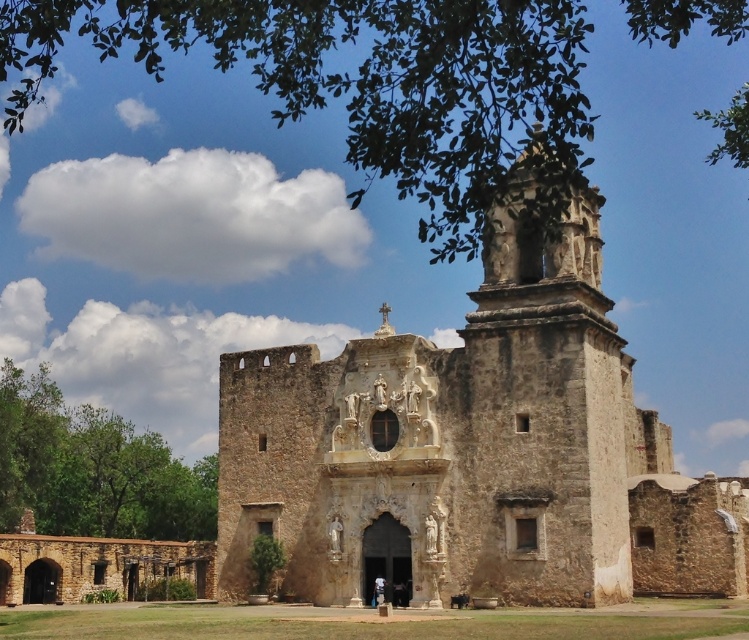
Question: Which point appears closest to the camera in this image?

Choices:
 (A) (55, 483)
 (B) (589, 397)
 (C) (377, 586)

Answer: (B)

Question: Which point is closer to the camera?

Choices:
 (A) green leafy tree at upper center
 (B) green leafy tree at lower left

Answer: (A)

Question: Does stone church at center have a greater width compared to white cotton shirt at center?

Choices:
 (A) yes
 (B) no

Answer: (A)

Question: In this image, where is stone church at center located relative to green leafy tree at upper center?

Choices:
 (A) above
 (B) below

Answer: (B)

Question: Which point is closer to the camera?

Choices:
 (A) (252, 484)
 (B) (380, 577)
 (C) (419, 10)
 (D) (42, 408)

Answer: (C)

Question: Does green leafy tree at upper center appear on the right side of white cotton shirt at center?

Choices:
 (A) no
 (B) yes

Answer: (A)